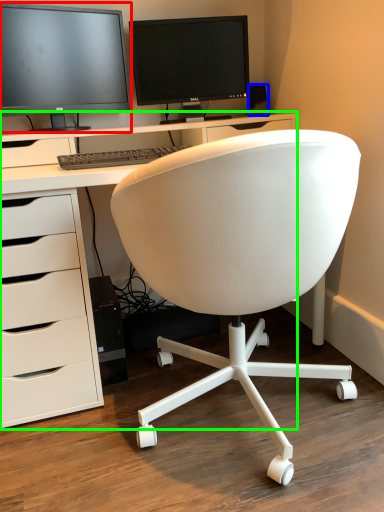
Question: Based on their relative distances, which object is nearer to computer monitor (highlighted by a red box)? Choose from office supplies (highlighted by a blue box) and desk (highlighted by a green box).

Choices:
 (A) office supplies
 (B) desk

Answer: (B)